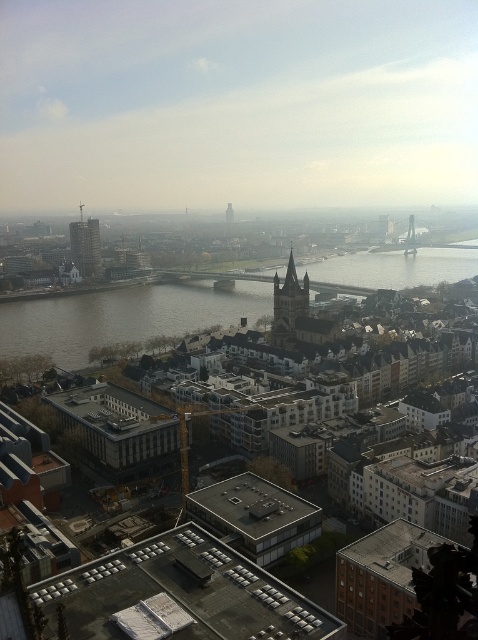
You are an urban planner reviewing the city layout. You notice a point at coordinates (86, 244) in the image. Based on the cityscape described, what type of building is located at this coordinate?

The point at coordinates (86, 244) corresponds to the matte glass skyscraper at center left.